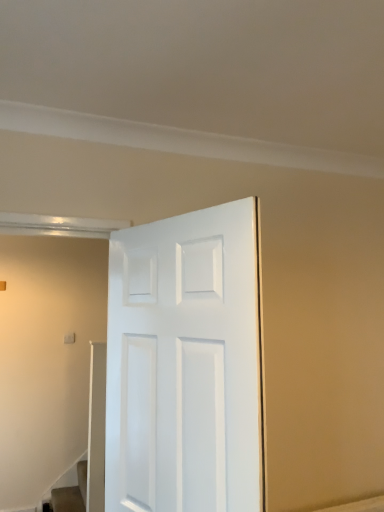
In order to face white matte door at center, should I rotate leftwards or rightwards?

You should rotate left by 2.998 degrees.

Image resolution: width=384 pixels, height=512 pixels. What do you see at coordinates (186, 364) in the screenshot? I see `white matte door at center` at bounding box center [186, 364].

Find the location of a particular element. The image size is (384, 512). white matte door at center is located at coordinates (186, 364).

Identify the location of white matte door at center. (186, 364).